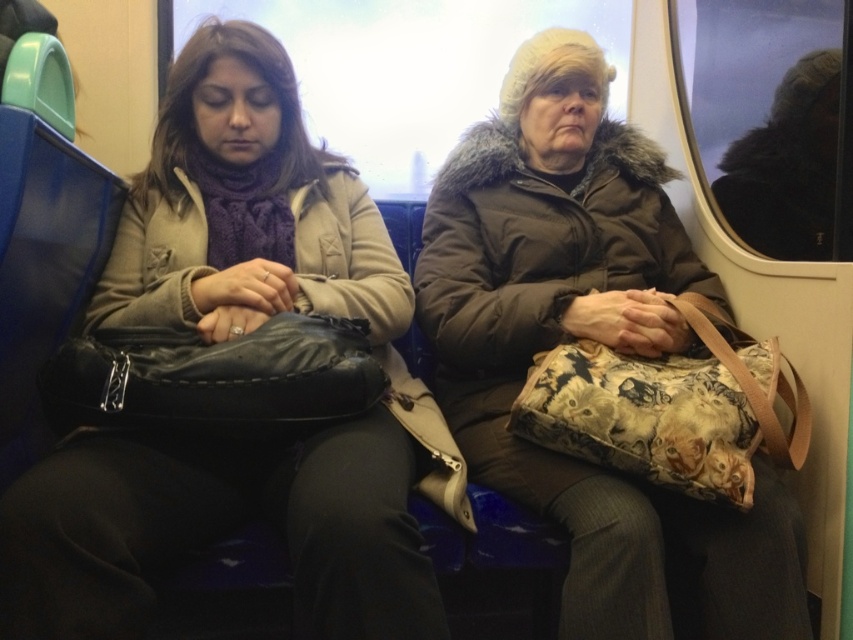
Can you confirm if matte black bag at left is smaller than brown fuzzy coat at center?

Yes.

Is matte black bag at left behind brown fuzzy coat at center?

No.

Who is more distant from viewer, (x=270, y=106) or (x=689, y=515)?

The point (x=270, y=106) is more distant.

Find the location of a particular element. matte black bag at left is located at coordinates (230, 339).